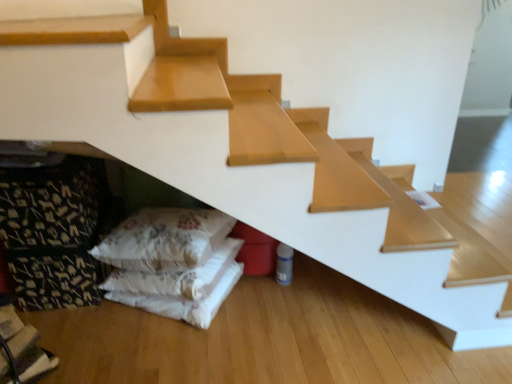
Question: Looking at the image, does white fabric pillows at lower left seem bigger or smaller compared to fluffy white pillow at lower left?

Choices:
 (A) small
 (B) big

Answer: (A)

Question: In terms of width, does white fabric pillows at lower left look wider or thinner when compared to fluffy white pillow at lower left?

Choices:
 (A) wide
 (B) thin

Answer: (A)

Question: In terms of height, does white fabric pillows at lower left look taller or shorter compared to fluffy white pillow at lower left?

Choices:
 (A) short
 (B) tall

Answer: (A)

Question: Considering the positions of fluffy white pillow at lower left and white fabric pillows at lower left in the image, is fluffy white pillow at lower left taller or shorter than white fabric pillows at lower left?

Choices:
 (A) short
 (B) tall

Answer: (B)

Question: In terms of width, does fluffy white pillow at lower left look wider or thinner when compared to white fabric pillows at lower left?

Choices:
 (A) wide
 (B) thin

Answer: (B)

Question: Based on their sizes in the image, would you say fluffy white pillow at lower left is bigger or smaller than white fabric pillows at lower left?

Choices:
 (A) big
 (B) small

Answer: (A)

Question: From the image's perspective, relative to white fabric pillows at lower left, is fluffy white pillow at lower left above or below?

Choices:
 (A) below
 (B) above

Answer: (B)